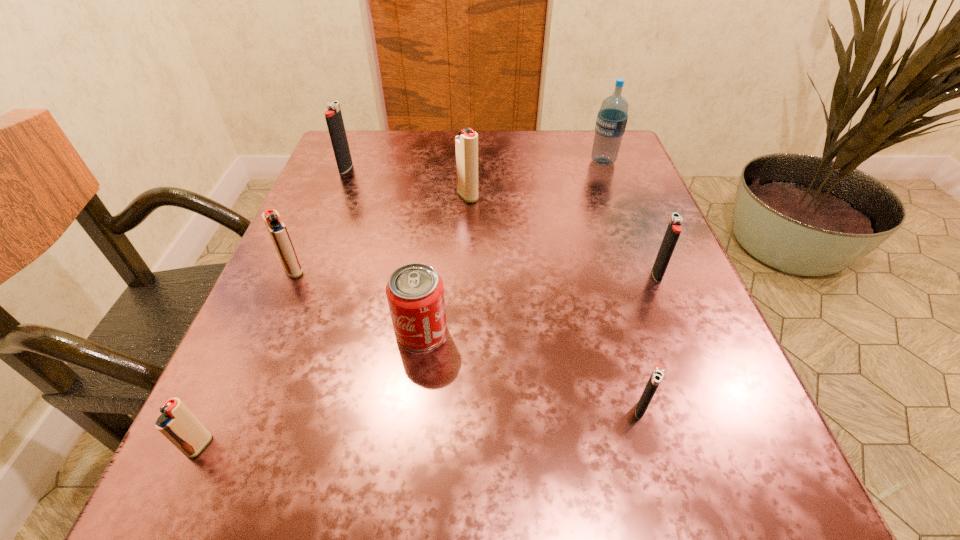
Find the location of `can`. can is located at coordinates (415, 293).

This screenshot has height=540, width=960. In order to click on the nearest red igniter in this screenshot , I will do `click(177, 423)`.

This screenshot has height=540, width=960. I want to click on the smallest red igniter, so click(177, 423).

Locate an element on the screen. The width and height of the screenshot is (960, 540). the nearest black igniter is located at coordinates (657, 374).

The width and height of the screenshot is (960, 540). In order to click on the second nearest igniter in this screenshot , I will do (657, 374).

Locate an element on the screen. vacant area located on the front of the tallest object is located at coordinates (640, 260).

This screenshot has width=960, height=540. What are the coordinates of `vacant region located on the front of the fourth object from right to left` in the screenshot? It's located at (462, 368).

The width and height of the screenshot is (960, 540). I want to click on vacant space located on the front of the biggest black igniter, so click(305, 269).

Find the location of a particular element. This screenshot has width=960, height=540. vacant area situated on the front of the second farthest black igniter is located at coordinates (693, 364).

Locate an element on the screen. This screenshot has height=540, width=960. vacant space located 0.270m on the right of the second biggest red igniter is located at coordinates (462, 271).